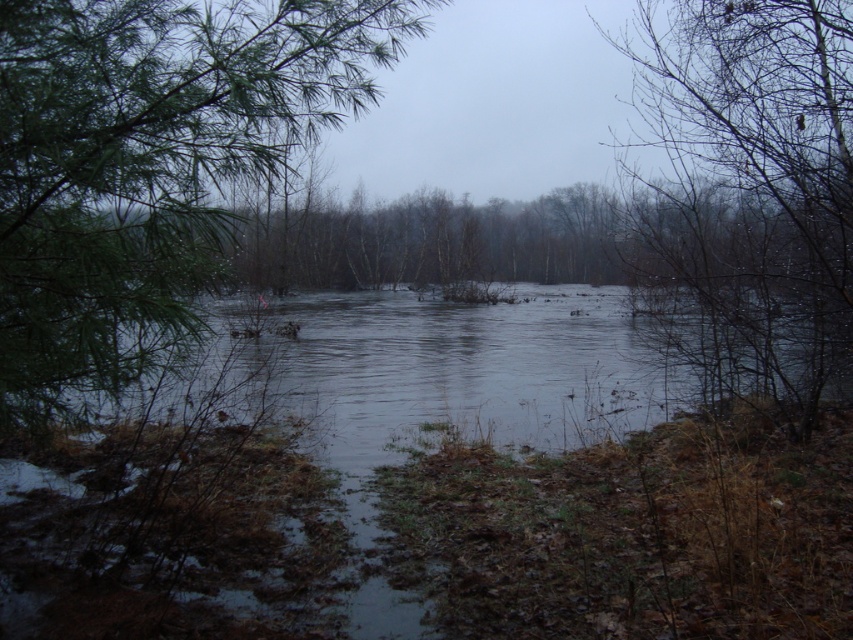
Does point (1, 593) come closer to viewer compared to point (152, 150)?

That is False.

What do you see at coordinates (432, 500) in the screenshot?
I see `dark gray water at center` at bounding box center [432, 500].

The width and height of the screenshot is (853, 640). I want to click on dark gray water at center, so click(x=432, y=500).

Can you confirm if green needle-like leaves at left is thinner than bare branches at center?

Incorrect, green needle-like leaves at left's width is not less than bare branches at center's.

The width and height of the screenshot is (853, 640). I want to click on green needle-like leaves at left, so click(149, 164).

The width and height of the screenshot is (853, 640). In order to click on green needle-like leaves at left in this screenshot , I will do `click(149, 164)`.

Is dark gray water at center closer to camera compared to bare branches at center?

Yes, it is in front of bare branches at center.

Can you confirm if dark gray water at center is positioned to the left of bare branches at center?

Indeed, dark gray water at center is positioned on the left side of bare branches at center.

Measure the distance between point (636, 614) and camera.

Point (636, 614) is 13.71 feet away from camera.

Locate an element on the screen. The height and width of the screenshot is (640, 853). dark gray water at center is located at coordinates (432, 500).